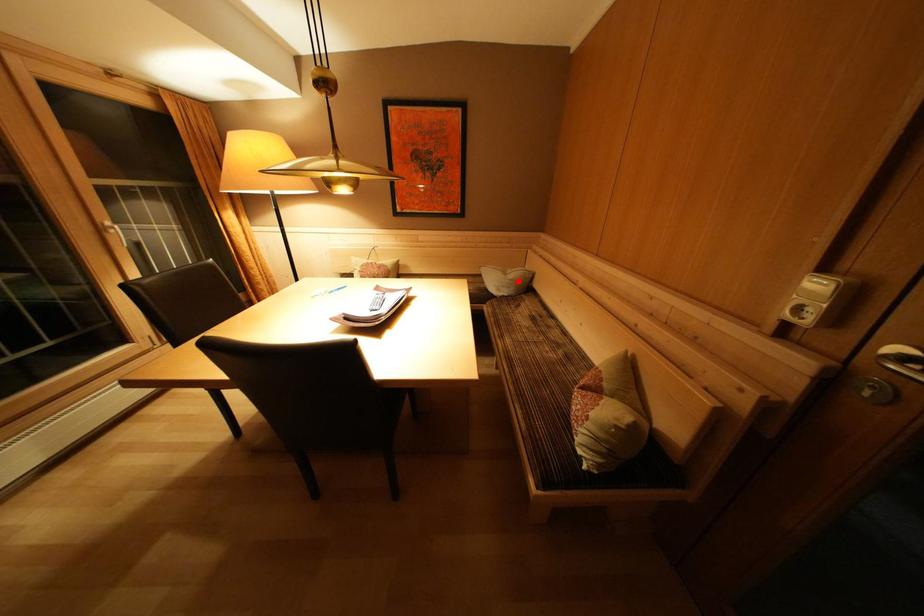
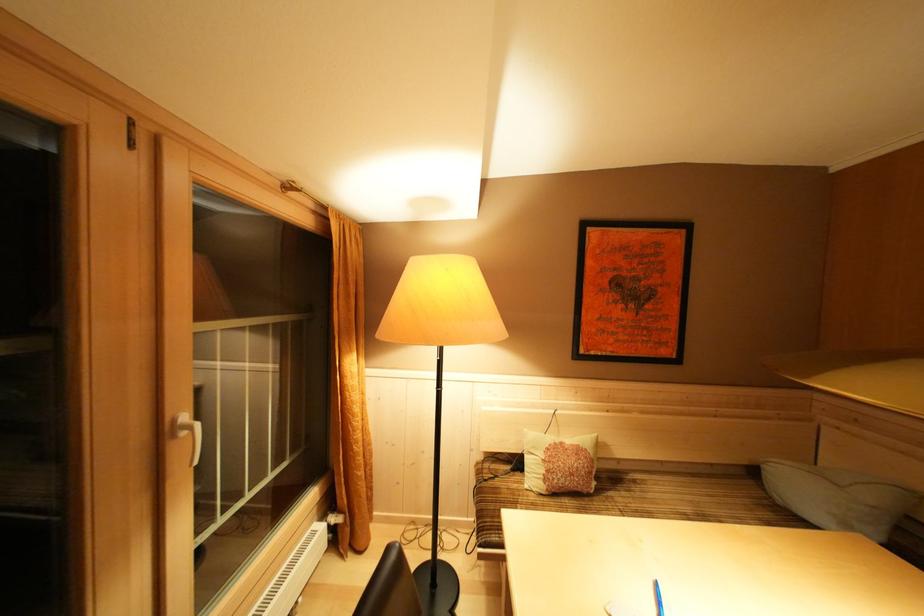
Locate, in the second image, the point that corresponds to the highlighted location in the first image.

(879, 503)